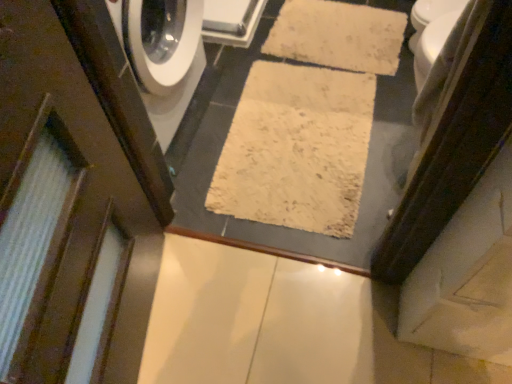
Locate an element on the screen. Image resolution: width=512 pixels, height=384 pixels. vacant space in beige textured bath mat at center (from a real-world perspective) is located at coordinates (312, 101).